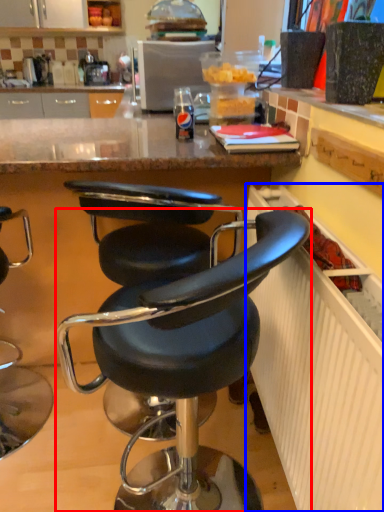
Question: Which object appears closest to the camera in this image, chair (highlighted by a red box) or radiator (highlighted by a blue box)?

Choices:
 (A) chair
 (B) radiator

Answer: (B)